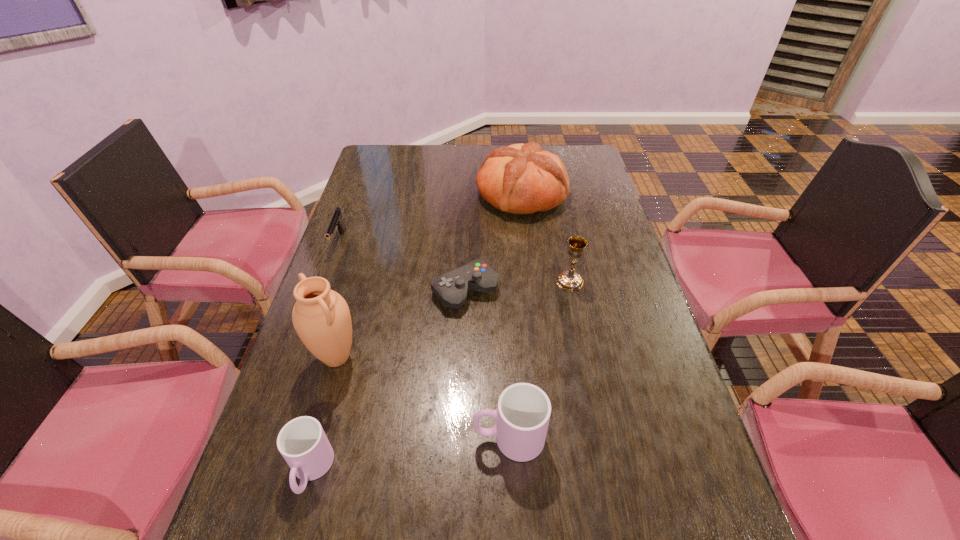
Considering the uniform spacing of cups, where should an additional cup be positioned on the right? Please locate a free spot. Please provide its 2D coordinates. Your answer should be formatted as a tuple, i.e. [(x, y)], where the tuple contains the x and y coordinates of a point satisfying the conditions above.

[(686, 409)]